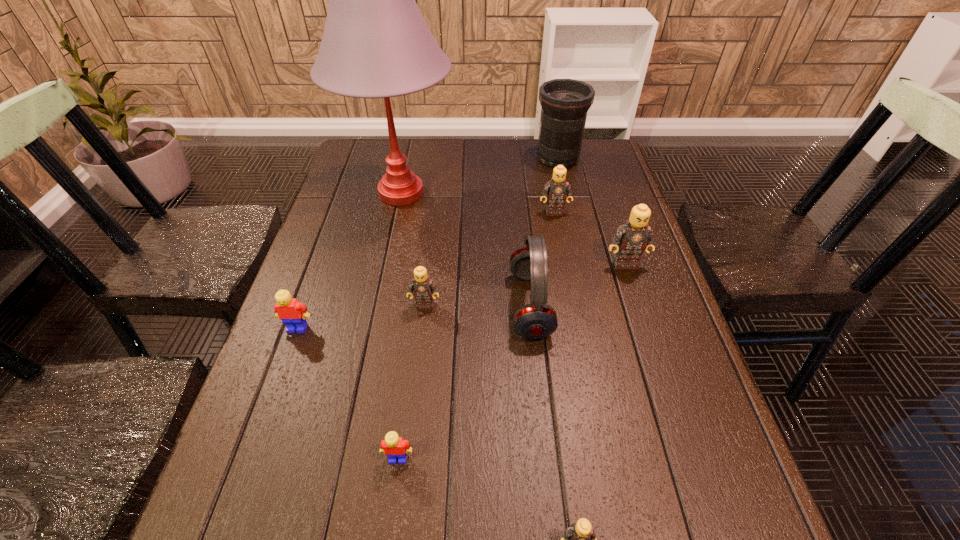
Select which object appears as the second closest to the farthest tan Lego. Please provide its 2D coordinates. Your answer should be formatted as a tuple, i.e. [(x, y)], where the tuple contains the x and y coordinates of a point satisfying the conditions above.

[(565, 102)]

Identify which object is the fifth nearest to the second tallest Lego. Please provide its 2D coordinates. Your answer should be formatted as a tuple, i.e. [(x, y)], where the tuple contains the x and y coordinates of a point satisfying the conditions above.

[(422, 286)]

Identify which Lego is the second nearest to the table lamp. Please provide its 2D coordinates. Your answer should be formatted as a tuple, i.e. [(x, y)], where the tuple contains the x and y coordinates of a point satisfying the conditions above.

[(422, 286)]

You are a GUI agent. You are given a task and a screenshot of the screen. Output one action in this format:
    pyautogui.click(x=<x>, y=<y>)
    Task: Click on the Lego that is the fourth closest one to the tallest object
    
    Given the screenshot: What is the action you would take?
    pyautogui.click(x=635, y=235)

Choose which tan Lego is the third nearest neighbor to the nearer yellow Lego. Please provide its 2D coordinates. Your answer should be formatted as a tuple, i.e. [(x, y)], where the tuple contains the x and y coordinates of a point satisfying the conditions above.

[(635, 235)]

This screenshot has width=960, height=540. What are the coordinates of `tan Lego that can be found as the closest to the second tallest object` in the screenshot? It's located at (558, 190).

At what (x,y) coordinates should I click in order to perform the action: click on vacant area that satisfies the following two spatial constraints: 1. in front of the second tallest Lego; 2. on the ear cups of the red earphone. Please return your answer as a coordinate pair (x, y). Image resolution: width=960 pixels, height=540 pixels. Looking at the image, I should click on (571, 305).

This screenshot has height=540, width=960. I want to click on vacant space that satisfies the following two spatial constraints: 1. in front of the third smallest tan Lego; 2. on the ear cups of the red earphone, so click(571, 305).

Locate an element on the screen. The image size is (960, 540). free spot that satisfies the following two spatial constraints: 1. on the ear cups of the red earphone; 2. on the front-facing side of the third nearest Lego is located at coordinates (533, 328).